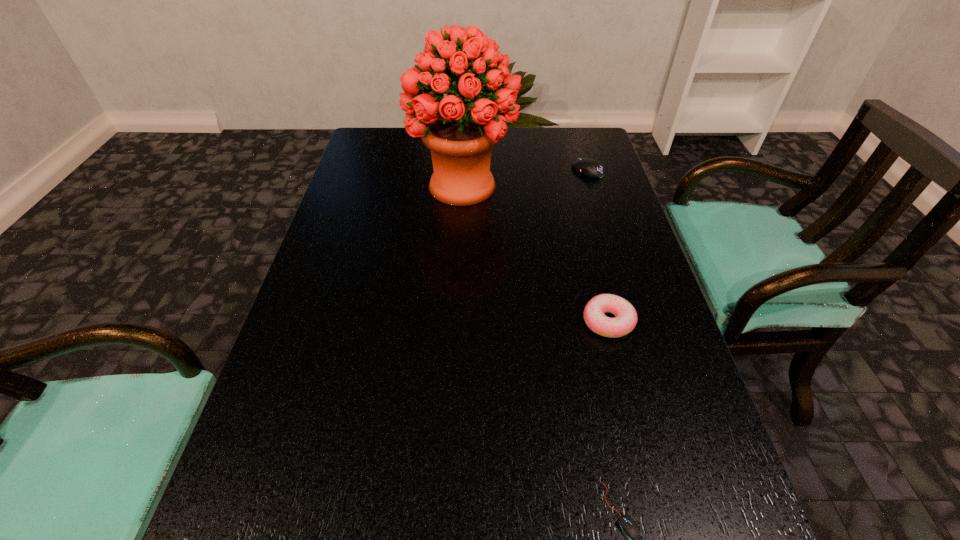
Identify the location of computer equipment that is at the far edge. (592, 168).

Image resolution: width=960 pixels, height=540 pixels. Find the location of `doughnut present at the right edge`. doughnut present at the right edge is located at coordinates (625, 320).

You are a GUI agent. You are given a task and a screenshot of the screen. Output one action in this format:
    pyautogui.click(x=<x>, y=<y>)
    Task: Click on the computer equipment at the right edge
    Image resolution: width=960 pixels, height=540 pixels.
    Given the screenshot: What is the action you would take?
    pyautogui.click(x=592, y=168)

Locate an element on the screen. The image size is (960, 540). object present at the far right corner is located at coordinates (592, 168).

In the image, there is a desktop. Where is `vacant space at the far edge`? vacant space at the far edge is located at coordinates (502, 145).

You are a GUI agent. You are given a task and a screenshot of the screen. Output one action in this format:
    pyautogui.click(x=<x>, y=<y>)
    Task: Click on the vacant space at the left edge
    
    Given the screenshot: What is the action you would take?
    [352, 277]

The height and width of the screenshot is (540, 960). I want to click on free point at the right edge, so click(586, 287).

You are a GUI agent. You are given a task and a screenshot of the screen. Output one action in this format:
    pyautogui.click(x=<x>, y=<y>)
    Task: Click on the blank space at the far left corner
    Image resolution: width=960 pixels, height=540 pixels.
    Given the screenshot: What is the action you would take?
    pyautogui.click(x=362, y=146)

Identify the location of vacant space at the far right corner of the desktop. (575, 141).

In order to click on vacant space that is in between the farther mouse and the tallest object in this screenshot , I will do `click(525, 178)`.